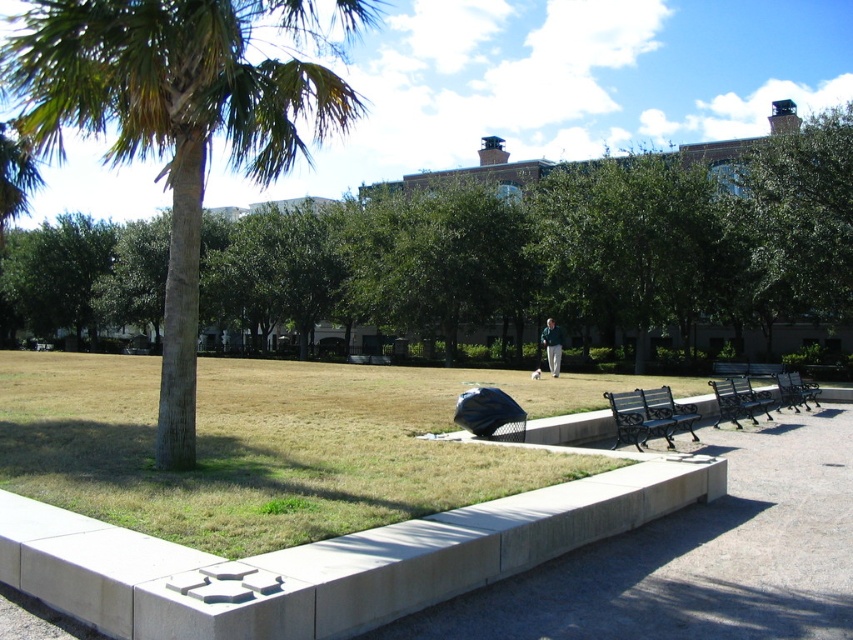
Question: Which object appears closest to the camera in this image?

Choices:
 (A) black wrought iron bench at lower right
 (B) metallic silver bench at center right

Answer: (A)

Question: Among these objects, which one is farthest from the camera?

Choices:
 (A) green leafy tree at center
 (B) light brown leather jacket at center

Answer: (B)

Question: Observing the image, what is the correct spatial positioning of green leafy tree at center in reference to wooden park bench at lower right?

Choices:
 (A) below
 (B) above

Answer: (B)

Question: Is metallic silver bench at center right thinner than wooden park bench at lower right?

Choices:
 (A) yes
 (B) no

Answer: (B)

Question: Which object is farther from the camera taking this photo?

Choices:
 (A) wooden park bench at lower right
 (B) black wrought iron bench at lower right

Answer: (A)

Question: Does black wrought iron bench at lower right appear on the right side of light brown leather jacket at center?

Choices:
 (A) yes
 (B) no

Answer: (B)